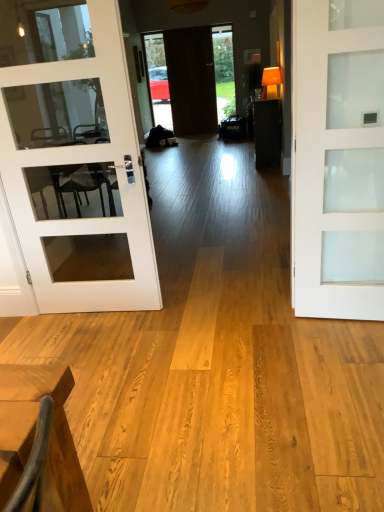
Measure the distance between dark wood table at center and camera.

dark wood table at center and camera are 5.66 meters apart from each other.

Where is `white frosted glass door at center, the third door from the back`? Image resolution: width=384 pixels, height=512 pixels. white frosted glass door at center, the third door from the back is located at coordinates (338, 159).

At what (x,y) coordinates should I click in order to perform the action: click on white glass door at left, the 2th door positioned from the top. Please return your answer as a coordinate pair (x, y). This screenshot has width=384, height=512. Looking at the image, I should click on (85, 162).

Find the location of `dark wood door at center, positioned as the second door in left-to-right order`. dark wood door at center, positioned as the second door in left-to-right order is located at coordinates pyautogui.click(x=191, y=80).

From a real-world perspective, between dark wood table at center and dark wood door at center, arranged as the third door when viewed from the front, who is vertically lower?

From a 3D spatial view, dark wood table at center is below.

Considering the sizes of objects dark wood table at center and dark wood door at center, arranged as the third door when viewed from the front, in the image provided, who is shorter, dark wood table at center or dark wood door at center, arranged as the third door when viewed from the front,?

Standing shorter between the two is dark wood table at center.

Which point is more distant from viewer, (267, 127) or (169, 61)?

The point (169, 61) is more distant.

Is the depth of dark wood table at center greater than that of dark wood door at center, positioned as the second door in left-to-right order?

No, dark wood table at center is closer to the camera.

Is the depth of dark wood door at center, positioned as the second door in left-to-right order, greater than that of white frosted glass door at center, placed as the third door when sorted from top to bottom?

Yes, the depth of dark wood door at center, positioned as the second door in left-to-right order, is greater than that of white frosted glass door at center, placed as the third door when sorted from top to bottom.

Considering the sizes of objects dark wood door at center, marked as the first door in a back-to-front arrangement, and white frosted glass door at center, marked as the first door in a right-to-left arrangement, in the image provided, who is bigger, dark wood door at center, marked as the first door in a back-to-front arrangement, or white frosted glass door at center, marked as the first door in a right-to-left arrangement,?

With larger size is dark wood door at center, marked as the first door in a back-to-front arrangement.

From the image's perspective, starting from the dark wood door at center, arranged as the third door when viewed from the front, which door is the 2nd one below? Please provide its 2D coordinates.

[(338, 159)]

Is dark wood door at center, the second door when ordered from right to left, facing towards white frosted glass door at center, the third door from the back?

Yes.

Can you tell me how much dark wood table at center and white frosted glass door at center, placed as the third door when sorted from top to bottom, differ in facing direction?

83.3 degrees separate the facing orientations of dark wood table at center and white frosted glass door at center, placed as the third door when sorted from top to bottom.

Could you measure the distance between dark wood table at center and white frosted glass door at center, placed as the third door when sorted from top to bottom?

dark wood table at center is 3.84 meters from white frosted glass door at center, placed as the third door when sorted from top to bottom.

I want to click on door that is the 1st one above the dark wood table at center (from a real-world perspective), so click(x=338, y=159).

Which object is closer to the camera, dark wood table at center or white frosted glass door at center, the third door positioned from the left?

Positioned in front is white frosted glass door at center, the third door positioned from the left.

From a real-world perspective, is white glass door at left, acting as the 2th door starting from the back, positioned over dark wood table at center based on gravity?

Indeed, from a real-world perspective, white glass door at left, acting as the 2th door starting from the back, stands above dark wood table at center.

Considering the relative sizes of white glass door at left, which ranks as the second door in bottom-to-top order, and dark wood table at center in the image provided, is white glass door at left, which ranks as the second door in bottom-to-top order, smaller than dark wood table at center?

Yes.

Is white glass door at left, which is counted as the second door, starting from the front, wider or thinner than dark wood table at center?

Clearly, white glass door at left, which is counted as the second door, starting from the front, has less width compared to dark wood table at center.

Between white glass door at left, the 1th door in the left-to-right sequence, and dark wood table at center, which one appears on the right side from the viewer's perspective?

Positioned to the right is dark wood table at center.

From the image's perspective, between dark wood door at center, marked as the first door in a back-to-front arrangement, and dark wood table at center, who is located below?

From the image's view, dark wood table at center is below.

Considering the relative sizes of dark wood door at center, marked as the 1th door in a top-to-bottom arrangement, and dark wood table at center in the image provided, is dark wood door at center, marked as the 1th door in a top-to-bottom arrangement, thinner than dark wood table at center?

Yes.

What's the angular difference between white glass door at left, the 1th door in the left-to-right sequence, and white frosted glass door at center, positioned as the first door in front-to-back order,'s facing directions?

There is a 5.86-degree angle between the facing directions of white glass door at left, the 1th door in the left-to-right sequence, and white frosted glass door at center, positioned as the first door in front-to-back order.

In the scene shown: Which object is closer to the camera, white glass door at left, acting as the 2th door starting from the back, or white frosted glass door at center, the third door from the back?

white frosted glass door at center, the third door from the back.

Between white glass door at left, the 1th door in the left-to-right sequence, and white frosted glass door at center, the third door from the back, which one has larger size?

Bigger between the two is white glass door at left, the 1th door in the left-to-right sequence.

Looking at this image, from the image's perspective, is white glass door at left, the 1th door in the left-to-right sequence, located above or below white frosted glass door at center, placed as the third door when sorted from top to bottom?

Clearly, from the image's perspective, white glass door at left, the 1th door in the left-to-right sequence, is above white frosted glass door at center, placed as the third door when sorted from top to bottom.

How much distance is there between clear glass door at center and dark wood table at center?

The distance of clear glass door at center from dark wood table at center is 2.58 meters.

Is clear glass door at center located outside dark wood table at center?

Indeed, clear glass door at center is completely outside dark wood table at center.

Is clear glass door at center smaller than dark wood table at center?

Yes, clear glass door at center is smaller than dark wood table at center.

Could you tell me if clear glass door at center is facing dark wood table at center?

No, clear glass door at center is not aimed at dark wood table at center.

Locate an element on the screen. This screenshot has height=512, width=384. the 2nd door counting from the left of the dark wood table at center is located at coordinates (191, 80).

Identify the location of door on the right of dark wood door at center, marked as the 1th door in a top-to-bottom arrangement. (338, 159).

Estimate the real-world distances between objects in this image. Which object is closer to dark wood table at center, white glass door at left, which ranks as the second door in bottom-to-top order, or dark wood door at center, marked as the first door in a back-to-front arrangement?

Among the two, dark wood door at center, marked as the first door in a back-to-front arrangement, is located nearer to dark wood table at center.

Estimate the real-world distances between objects in this image. Which object is further from dark wood table at center, clear glass door at center or white frosted glass door at center, positioned as the first door in front-to-back order?

white frosted glass door at center, positioned as the first door in front-to-back order, is positioned further to the anchor dark wood table at center.

Estimate the real-world distances between objects in this image. Which object is closer to dark wood door at center, marked as the 1th door in a top-to-bottom arrangement, clear glass door at center or dark wood table at center?

clear glass door at center is closer to dark wood door at center, marked as the 1th door in a top-to-bottom arrangement.

Based on their spatial positions, is white glass door at left, the 2th door positioned from the top, or white frosted glass door at center, positioned as the first door in front-to-back order, closer to clear glass door at center?

white glass door at left, the 2th door positioned from the top, is positioned closer to the anchor clear glass door at center.

Looking at the image, which one is located closer to white frosted glass door at center, the third door from the back, white glass door at left, marked as the 3th door in a right-to-left arrangement, or dark wood table at center?

Among the two, white glass door at left, marked as the 3th door in a right-to-left arrangement, is located nearer to white frosted glass door at center, the third door from the back.

Looking at the image, which one is located further to white frosted glass door at center, the third door from the back, dark wood table at center or white glass door at left, the 1th door in the left-to-right sequence?

Based on the image, dark wood table at center appears to be further to white frosted glass door at center, the third door from the back.

From the image, which object appears to be nearer to dark wood door at center, arranged as the third door when viewed from the front, dark wood table at center or clear glass door at center?

Based on the image, clear glass door at center appears to be nearer to dark wood door at center, arranged as the third door when viewed from the front.

Which object lies nearer to the anchor point clear glass door at center, white glass door at left, which is counted as the second door, starting from the front, or dark wood table at center?

dark wood table at center is closer to clear glass door at center.

I want to click on door between white frosted glass door at center, positioned as the first door in front-to-back order, and clear glass door at center from front to back, so click(85, 162).

Locate an element on the screen. The image size is (384, 512). table between white glass door at left, marked as the 3th door in a right-to-left arrangement, and dark wood door at center, arranged as the third door when viewed from the front, along the z-axis is located at coordinates (267, 132).

You are a GUI agent. You are given a task and a screenshot of the screen. Output one action in this format:
    pyautogui.click(x=<x>, y=<y>)
    Task: Click on the window positioned between dark wood table at center and dark wood door at center, positioned as the second door in left-to-right order, from near to far
    The height and width of the screenshot is (512, 384).
    Given the screenshot: What is the action you would take?
    pyautogui.click(x=224, y=71)

Locate an element on the screen. This screenshot has height=512, width=384. table located between white glass door at left, which is counted as the second door, starting from the front, and clear glass door at center in the depth direction is located at coordinates (267, 132).